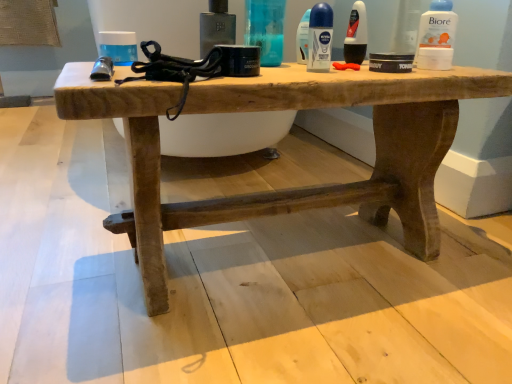
Question: Considering their positions, is rustic wood table at center located in front of or behind matte black deodorant at center, placed as the first toiletry when sorted from right to left?

Choices:
 (A) front
 (B) behind

Answer: (A)

Question: From their relative heights in the image, would you say rustic wood table at center is taller or shorter than matte black deodorant at center, the third toiletry viewed from the left?

Choices:
 (A) tall
 (B) short

Answer: (A)

Question: Based on their relative distances, which object is farther from the metallic black toiletry at upper center, which is counted as the first toiletry, starting from the left?

Choices:
 (A) rustic wood table at center
 (B) blue glossy deodorant stick at center, placed as the 1th mouthwash when sorted from front to back
 (C) translucent plastic bottle at upper center, which is the second toiletry from left to right
 (D) blue matte deodorant at upper center, arranged as the first mouthwash when viewed from the back
 (E) white plastic biore at upper right, which is the 2th mouthwash in back-to-front order

Answer: (E)

Question: Estimate the real-world distances between objects in this image. Which object is closer to the matte black deodorant at center, placed as the first toiletry when sorted from right to left?

Choices:
 (A) blue matte deodorant at upper center, arranged as the first mouthwash when viewed from the back
 (B) rustic wood table at center
 (C) metallic black toiletry at upper center, the 3th toiletry in the right-to-left sequence
 (D) blue glossy deodorant stick at center, placed as the 1th mouthwash when sorted from front to back
 (E) white plastic biore at upper right, which appears as the 3th mouthwash when viewed from the left

Answer: (D)